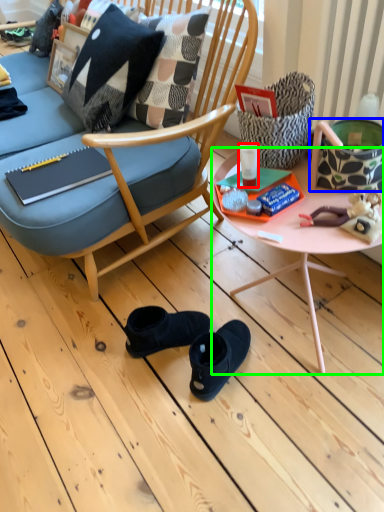
Question: Which object is the farthest from coffee cup (highlighted by a red box)? Choose among these: handbag (highlighted by a blue box) or desk (highlighted by a green box).

Choices:
 (A) handbag
 (B) desk

Answer: (A)